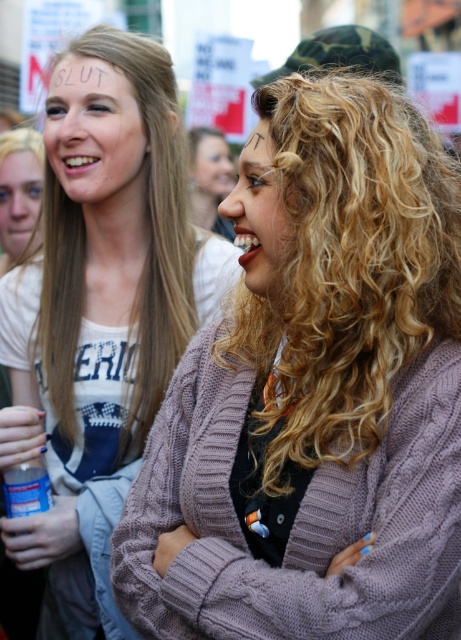
You are a photographer trying to capture the two women in the scene. You notice two specific points marked at coordinates point (224,266) and point (202,148). Which point is closer to the camera based on their positions?

Point (224,266) is in front of point (202,148), so it is closer to the camera.